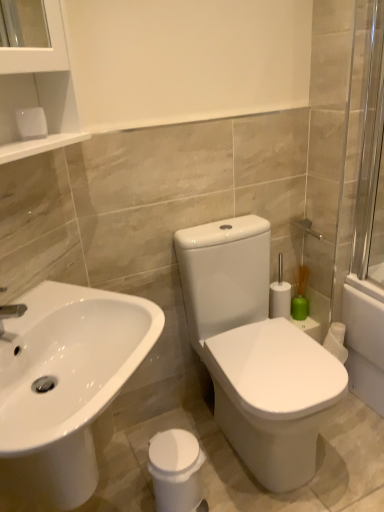
Image resolution: width=384 pixels, height=512 pixels. I want to click on empty space that is ontop of white glossy trash can at lower center (from a real-world perspective), so click(x=173, y=454).